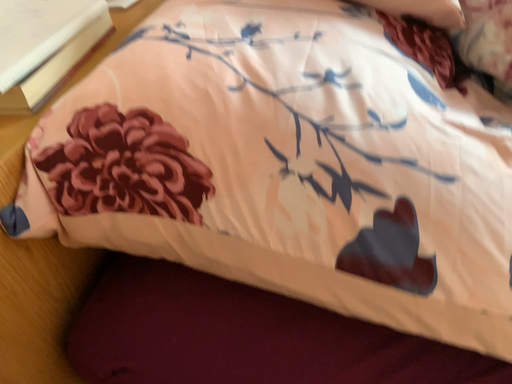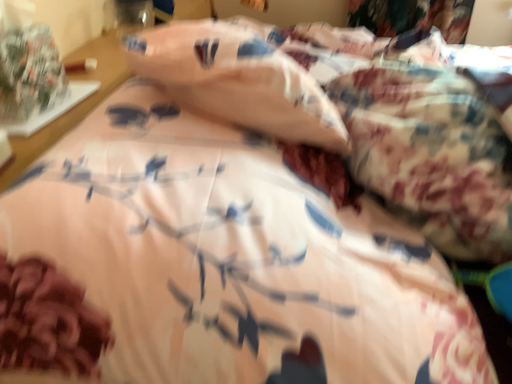
Question: How did the camera likely rotate when shooting the video?

Choices:
 (A) rotated left
 (B) rotated right

Answer: (B)